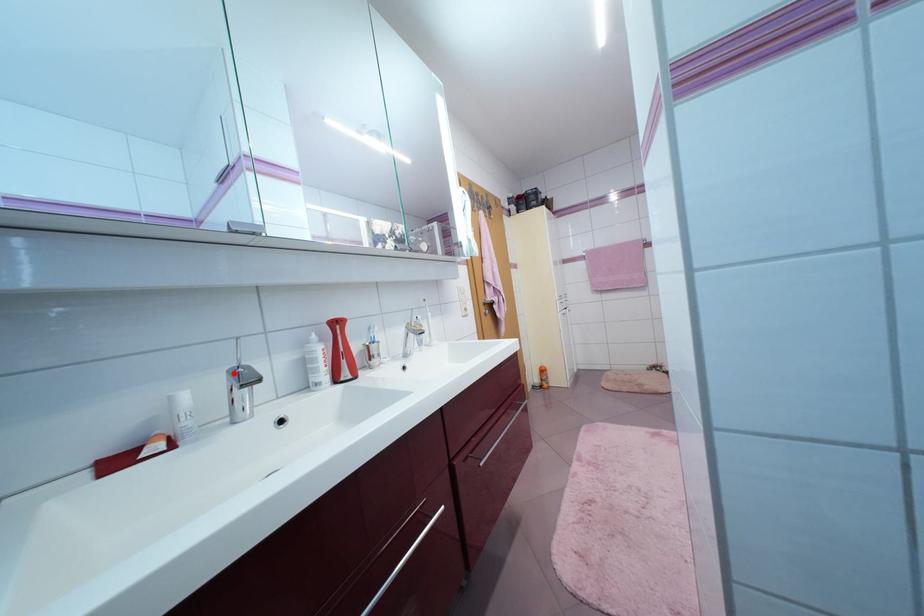
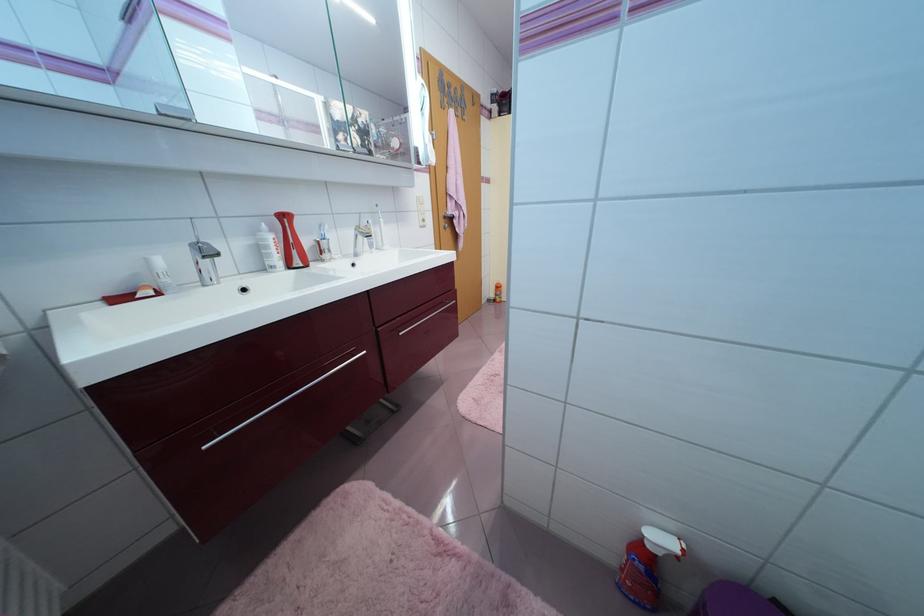
In the second image, find the point that corresponds to the highlighted location in the first image.

(196, 246)